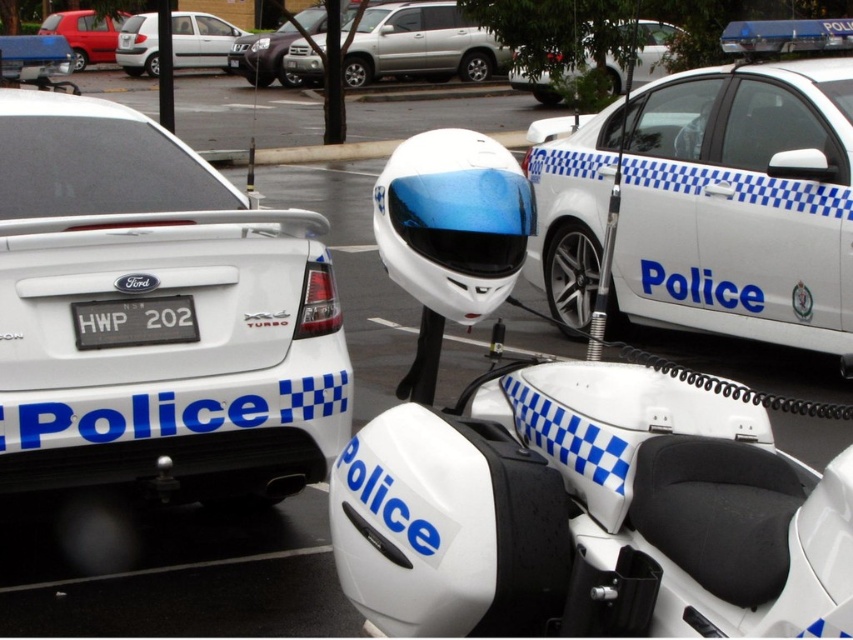
Is point (645, 202) closer to camera compared to point (152, 54)?

Yes, it is.

Can you confirm if white glossy police car at center is positioned to the left of silver metallic hatchback at upper left?

Incorrect, white glossy police car at center is not on the left side of silver metallic hatchback at upper left.

Does point (605, 212) come in front of point (143, 29)?

Yes, point (605, 212) is closer to viewer.

I want to click on white glossy police car at center, so click(711, 196).

Is white glossy police car at center positioned at the back of matte silver suv at upper center?

No, white glossy police car at center is closer to the viewer.

Is white glossy police car at center below matte silver suv at upper center?

Correct, white glossy police car at center is located below matte silver suv at upper center.

Does point (637, 109) lie behind point (263, 49)?

No, it is not.

Image resolution: width=853 pixels, height=640 pixels. What are the coordinates of `white glossy police car at center` in the screenshot? It's located at (711, 196).

At what (x,y) coordinates should I click in order to perform the action: click on silver metallic suv at upper center. Please return your answer as a coordinate pair (x, y). The height and width of the screenshot is (640, 853). Looking at the image, I should click on (419, 44).

What do you see at coordinates (419, 44) in the screenshot?
I see `silver metallic suv at upper center` at bounding box center [419, 44].

Find the location of `silver metallic suv at upper center`. silver metallic suv at upper center is located at coordinates (419, 44).